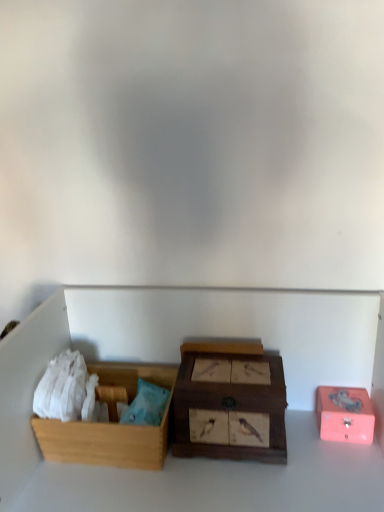
Question: Looking at the image, does pink matte box at right, which is the 1th box in right-to-left order, seem bigger or smaller compared to wooden box with bird pictures at center, which appears as the 2th box when viewed from the left?

Choices:
 (A) small
 (B) big

Answer: (A)

Question: In the image, is pink matte box at right, arranged as the 3th box when viewed from the left, positioned in front of or behind wooden box with bird pictures at center, positioned as the 2th box in right-to-left order?

Choices:
 (A) front
 (B) behind

Answer: (B)

Question: Which is farther from the wooden box with bird pictures at center, positioned as the 2th box in right-to-left order?

Choices:
 (A) pink matte box at right, arranged as the 3th box when viewed from the left
 (B) wooden box at left, placed as the 3th box when sorted from right to left

Answer: (A)

Question: Which is farther from the wooden box at left, positioned as the first box in left-to-right order?

Choices:
 (A) pink matte box at right, arranged as the 3th box when viewed from the left
 (B) wooden box with bird pictures at center, positioned as the 2th box in right-to-left order

Answer: (A)